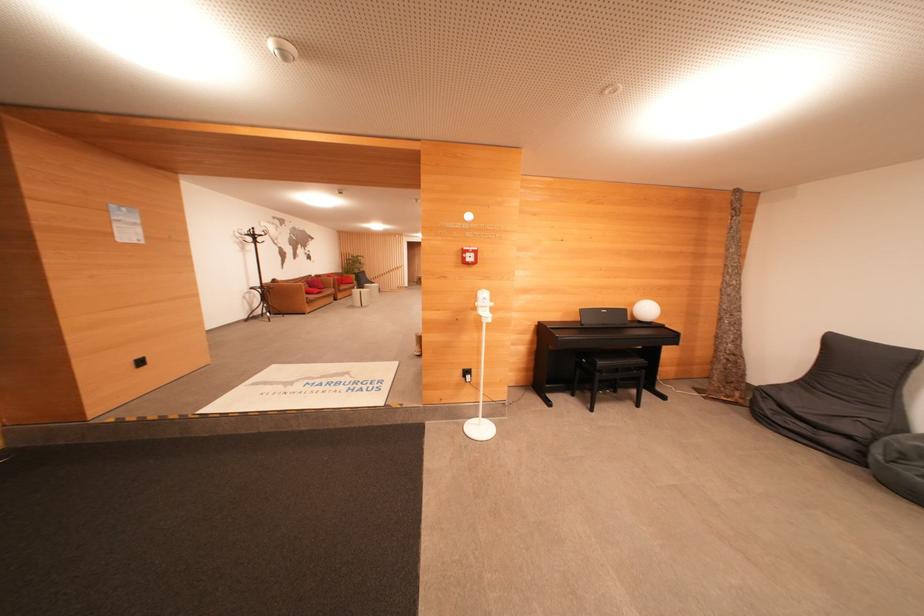
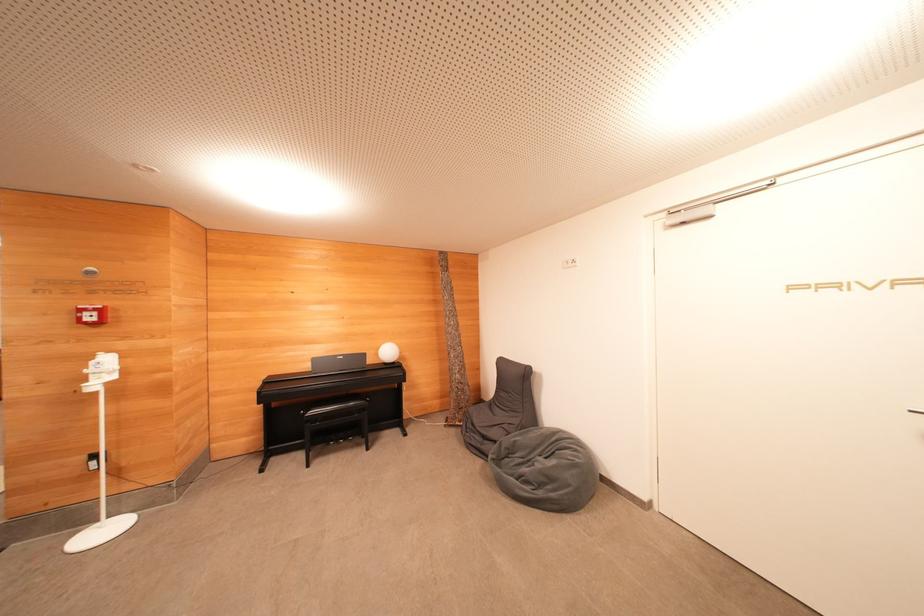
Question: Which direction would the cameraman need to move to produce the second image? Reply with the corresponding letter.

Choices:
 (A) Left
 (B) Right
 (C) Forward
 (D) Backward

Answer: (B)